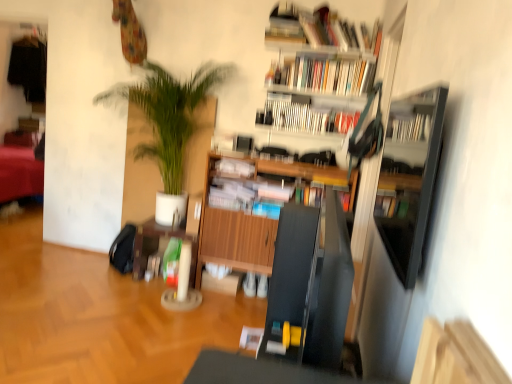
Question: Is hardcover books at upper center, the fourth book positioned from the bottom, next to wooden bookshelf at upper center and touching it?

Choices:
 (A) yes
 (B) no

Answer: (A)

Question: Is hardcover books at upper center, placed as the first book when sorted from top to bottom, to the left of wooden bookshelf at upper center from the viewer's perspective?

Choices:
 (A) yes
 (B) no

Answer: (B)

Question: Does hardcover books at upper center, placed as the first book when sorted from top to bottom, have a lesser height compared to wooden bookshelf at upper center?

Choices:
 (A) yes
 (B) no

Answer: (A)

Question: Is hardcover books at upper center, placed as the first book when sorted from top to bottom, looking in the opposite direction of wooden bookshelf at upper center?

Choices:
 (A) yes
 (B) no

Answer: (B)

Question: From a real-world perspective, is hardcover books at upper center, placed as the first book when sorted from top to bottom, beneath wooden bookshelf at upper center?

Choices:
 (A) no
 (B) yes

Answer: (A)

Question: Considering their positions, is hardcover books at upper center, placed as the first book when sorted from top to bottom, located in front of or behind wooden cabinet at center, which is counted as the second shelf, starting from the front?

Choices:
 (A) behind
 (B) front

Answer: (A)

Question: In terms of height, does hardcover books at upper center, the fourth book positioned from the bottom, look taller or shorter compared to wooden cabinet at center, which is counted as the second shelf, starting from the front?

Choices:
 (A) tall
 (B) short

Answer: (B)

Question: From the image's perspective, is hardcover books at upper center, placed as the first book when sorted from top to bottom, located above or below wooden cabinet at center, which appears as the 1th shelf when viewed from the back?

Choices:
 (A) above
 (B) below

Answer: (A)

Question: Would you say hardcover books at upper center, the fourth book positioned from the bottom, is to the left or to the right of wooden cabinet at center, which is counted as the second shelf, starting from the front, in the picture?

Choices:
 (A) left
 (B) right

Answer: (B)

Question: From the image's perspective, relative to hardcover book at upper center, which is counted as the 2th book, starting from the bottom, is wooden cabinet at center above or below?

Choices:
 (A) above
 (B) below

Answer: (B)

Question: In terms of height, does wooden cabinet at center look taller or shorter compared to hardcover book at upper center, which is counted as the 2th book, starting from the bottom?

Choices:
 (A) tall
 (B) short

Answer: (A)

Question: Which is correct: wooden cabinet at center is inside hardcover book at upper center, which is counted as the 2th book, starting from the bottom, or outside of it?

Choices:
 (A) outside
 (B) inside

Answer: (A)

Question: In the image, is wooden cabinet at center positioned in front of or behind hardcover book at upper center, which is counted as the 2th book, starting from the bottom?

Choices:
 (A) front
 (B) behind

Answer: (B)

Question: Does point (435, 135) appear closer or farther from the camera than point (229, 160)?

Choices:
 (A) closer
 (B) farther

Answer: (A)

Question: From a real-world perspective, is black glossy shelf at right, positioned as the first shelf in front-to-back order, positioned above or below white paper at center, which appears as the 1th book when ordered from the bottom?

Choices:
 (A) above
 (B) below

Answer: (A)